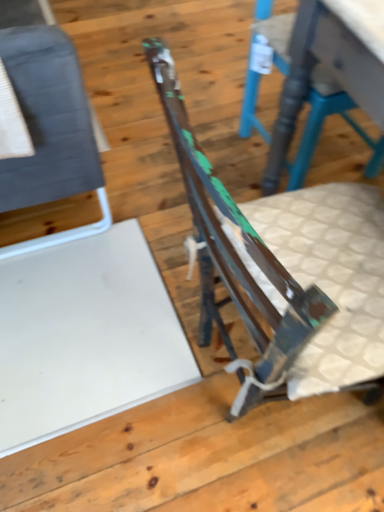
Question: From the image's perspective, is matte gray fabric chair at left, which is the first chair from left to right, located above rustic wood chair at center, arranged as the 3th chair when viewed from the left?

Choices:
 (A) yes
 (B) no

Answer: (A)

Question: Is rustic wood chair at center, which is the 1th chair from right to left, at the back of matte gray fabric chair at left, the third chair when ordered from right to left?

Choices:
 (A) yes
 (B) no

Answer: (B)

Question: Is matte gray fabric chair at left, the third chair when ordered from right to left, positioned in front of rustic wood chair at center, arranged as the 3th chair when viewed from the left?

Choices:
 (A) no
 (B) yes

Answer: (B)

Question: Is matte gray fabric chair at left, the third chair when ordered from right to left, wider than rustic wood chair at center, which is the 1th chair from right to left?

Choices:
 (A) no
 (B) yes

Answer: (A)

Question: From the image's perspective, is matte gray fabric chair at left, which is the first chair from left to right, located beneath rustic wood chair at center, which is the 1th chair from right to left?

Choices:
 (A) yes
 (B) no

Answer: (B)

Question: Is matte gray fabric chair at left, which is the first chair from left to right, further to the viewer compared to rustic wood chair at center, which is the 1th chair from right to left?

Choices:
 (A) no
 (B) yes

Answer: (A)

Question: Is rusty metal chair at center, positioned as the 2th chair in left-to-right order, located within matte gray fabric chair at left, which is the first chair from left to right?

Choices:
 (A) no
 (B) yes

Answer: (A)

Question: Considering the relative positions of matte gray fabric chair at left, the third chair when ordered from right to left, and rusty metal chair at center, positioned as the 2th chair in left-to-right order, in the image provided, is matte gray fabric chair at left, the third chair when ordered from right to left, to the right of rusty metal chair at center, positioned as the 2th chair in left-to-right order, from the viewer's perspective?

Choices:
 (A) yes
 (B) no

Answer: (B)

Question: Can you confirm if matte gray fabric chair at left, which is the first chair from left to right, is smaller than rusty metal chair at center, positioned as the 2th chair in left-to-right order?

Choices:
 (A) no
 (B) yes

Answer: (A)

Question: Does matte gray fabric chair at left, the third chair when ordered from right to left, come in front of rusty metal chair at center, positioned as the 2th chair in left-to-right order?

Choices:
 (A) no
 (B) yes

Answer: (A)

Question: Would you say matte gray fabric chair at left, which is the first chair from left to right, is a long distance from rusty metal chair at center, placed as the 2th chair when sorted from right to left?

Choices:
 (A) no
 (B) yes

Answer: (A)

Question: Considering the relative sizes of matte gray fabric chair at left, the third chair when ordered from right to left, and rusty metal chair at center, placed as the 2th chair when sorted from right to left, in the image provided, is matte gray fabric chair at left, the third chair when ordered from right to left, taller than rusty metal chair at center, placed as the 2th chair when sorted from right to left,?

Choices:
 (A) no
 (B) yes

Answer: (A)

Question: From a real-world perspective, is rusty metal chair at center, placed as the 2th chair when sorted from right to left, over rustic wood chair at center, which is the 1th chair from right to left?

Choices:
 (A) yes
 (B) no

Answer: (A)